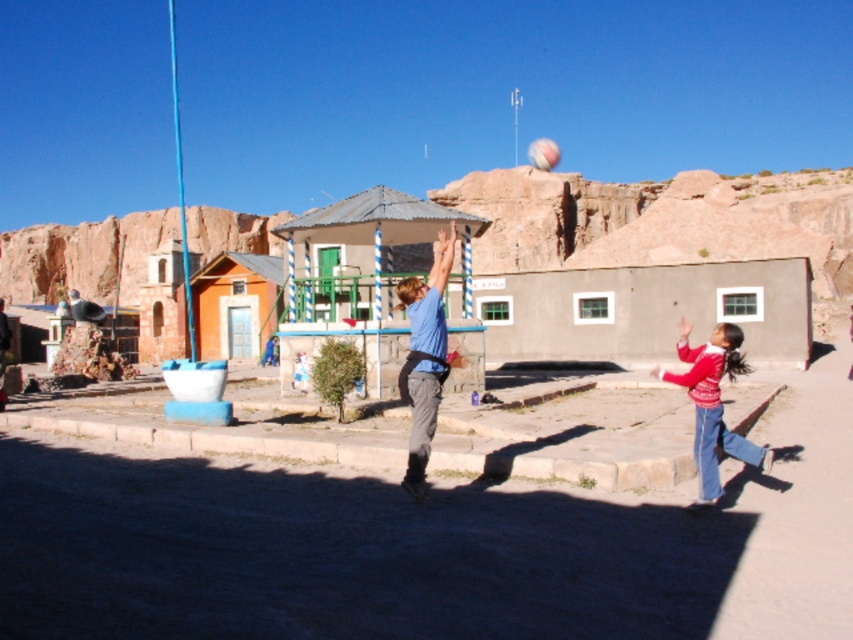
Question: Observing the image, what is the correct spatial positioning of blue matte shirt at center in reference to red sweater at lower right?

Choices:
 (A) right
 (B) left

Answer: (B)

Question: Which of the following is the farthest from the observer?

Choices:
 (A) pyautogui.click(x=701, y=436)
 (B) pyautogui.click(x=404, y=394)

Answer: (B)

Question: Can you confirm if blue matte shirt at center is positioned to the right of red sweater at lower right?

Choices:
 (A) yes
 (B) no

Answer: (B)

Question: Can you confirm if blue matte shirt at center is positioned above red sweater at lower right?

Choices:
 (A) yes
 (B) no

Answer: (A)

Question: Which point appears farthest from the camera in this image?

Choices:
 (A) (711, 376)
 (B) (418, 442)

Answer: (B)

Question: Which of the following is the closest to the observer?

Choices:
 (A) blue matte shirt at center
 (B) red sweater at lower right

Answer: (B)